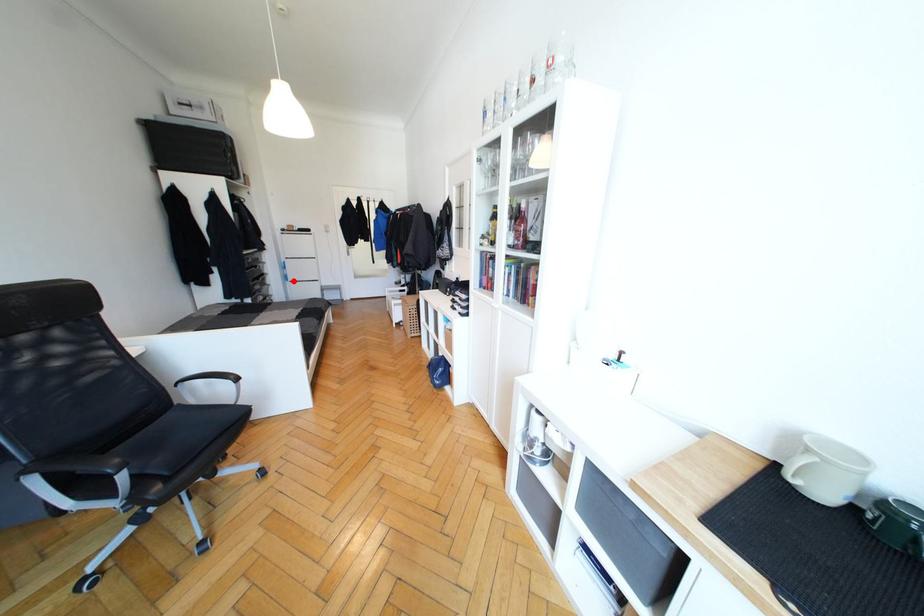
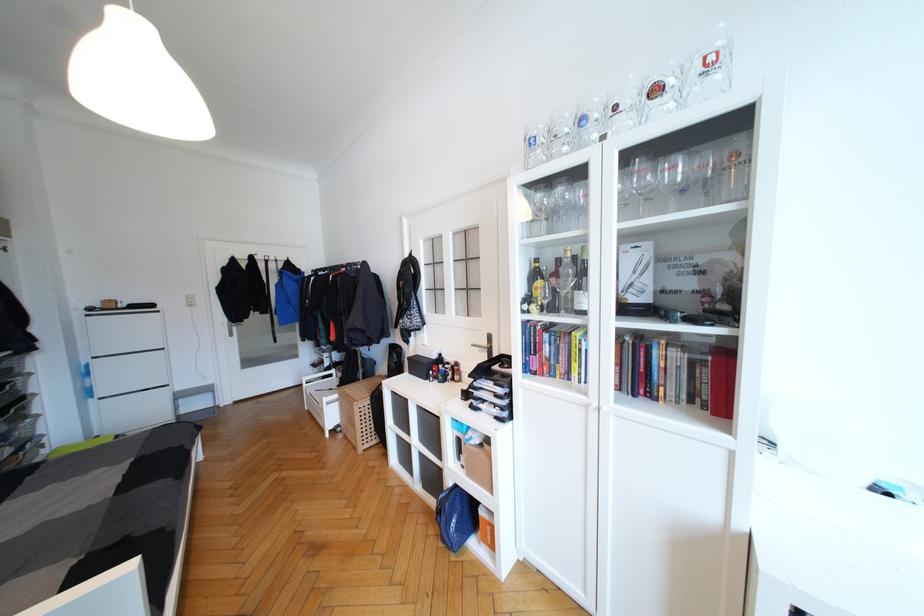
In the second image, find the point that corresponds to the highlighted location in the first image.

(103, 395)